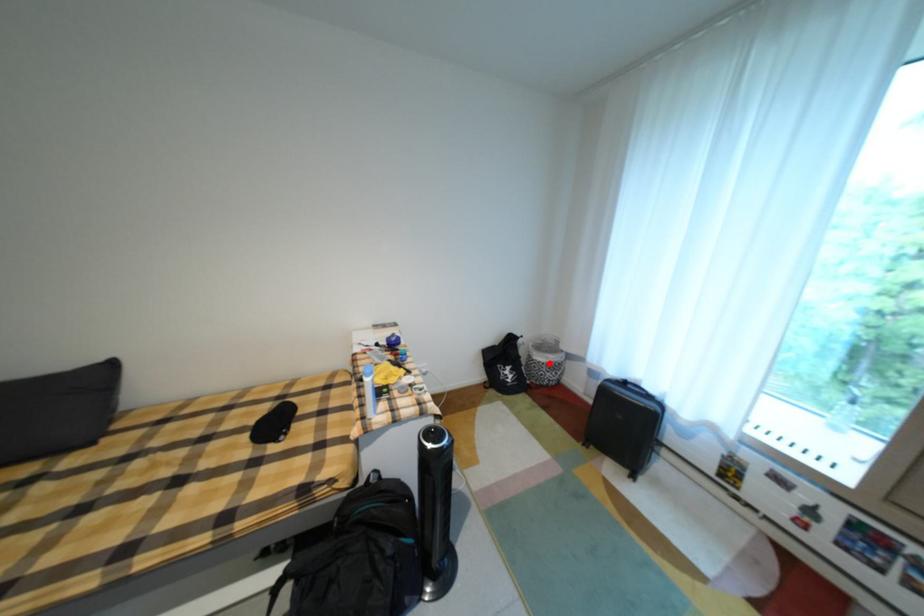
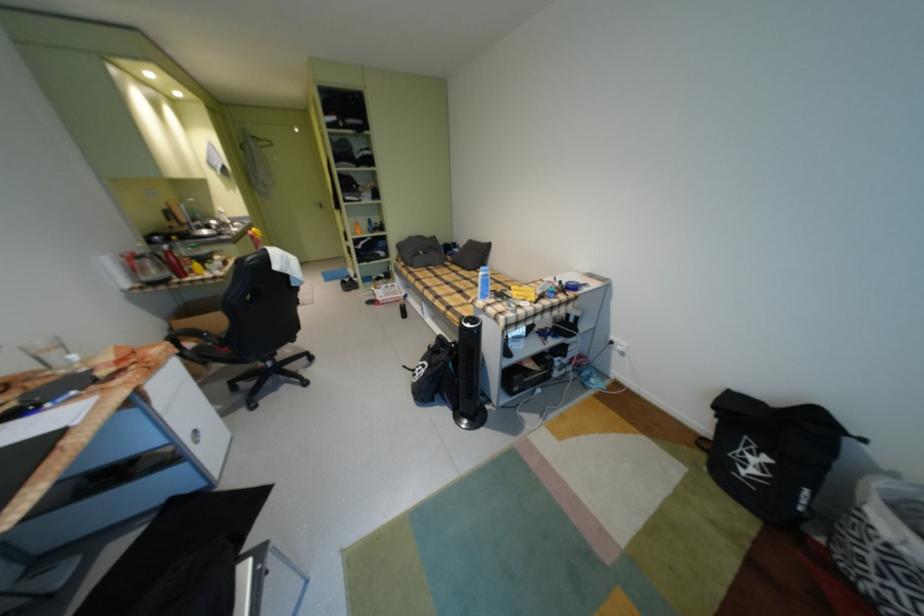
Question: I am providing you with two images of the same scene from different viewpoints. A red point is marked on the first image. At the location where the point appears in image 1, is it still visible in image 2?

Choices:
 (A) Yes
 (B) No

Answer: (A)